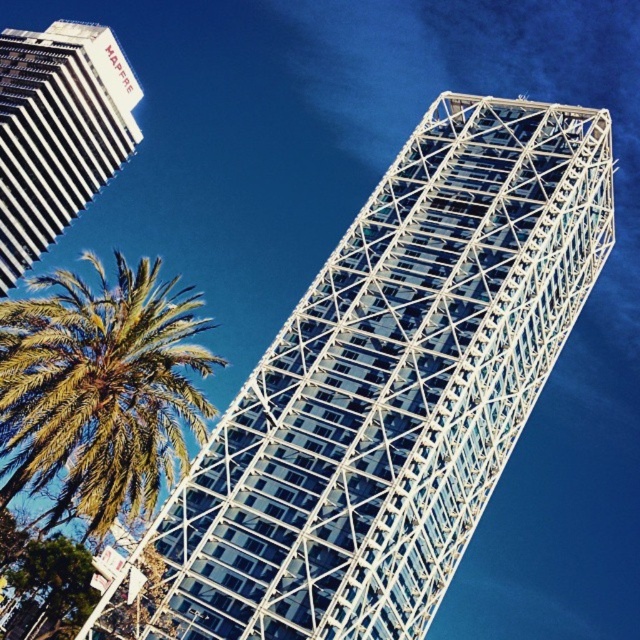
You are standing in the architectural scene and want to take a photo. There are two points marked in the image, point 1 at coordinates point (412, 547) and point 2 at coordinates point (22, 310). Which point is closer to your camera?

Point (412, 547) is further to the camera than point (22, 310), so point (22, 310) is closer to the camera.

You are standing in the middle of the city park and see the white glass tower at center and the green leafy palm tree at lower left. Which object is closer to you based on their positions?

The green leafy palm tree at lower left is closer to you because it is positioned under the white glass tower at center, indicating it is in a lower plane.

You are standing at the origin point in the image. Which direction should you move to reach the white glass tower at center?

The white glass tower at center is located at point 0.611 on the x and 0.606 on the y axis, so you should move northeast to reach it.